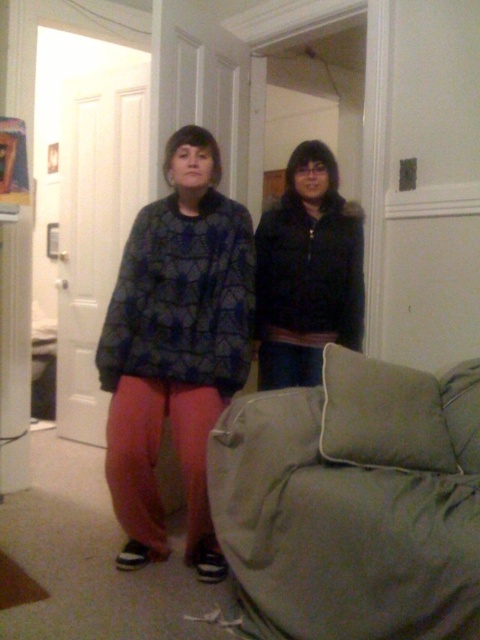
Question: Does sage green fabric couch at lower right appear on the right side of matte black jacket at center?

Choices:
 (A) yes
 (B) no

Answer: (A)

Question: Is matte black jacket at center smaller than black matte jacket at center?

Choices:
 (A) no
 (B) yes

Answer: (A)

Question: Among these objects, which one is nearest to the camera?

Choices:
 (A) sage green fabric couch at lower right
 (B) matte black jacket at center
 (C) black matte jacket at center

Answer: (A)

Question: Which point is closer to the camera taking this photo?

Choices:
 (A) (331, 595)
 (B) (204, 157)
 (C) (284, 205)

Answer: (A)

Question: Can you confirm if sage green fabric couch at lower right is positioned to the right of matte black jacket at center?

Choices:
 (A) yes
 (B) no

Answer: (A)

Question: Among these objects, which one is nearest to the camera?

Choices:
 (A) sage green fabric couch at lower right
 (B) matte black jacket at center

Answer: (A)